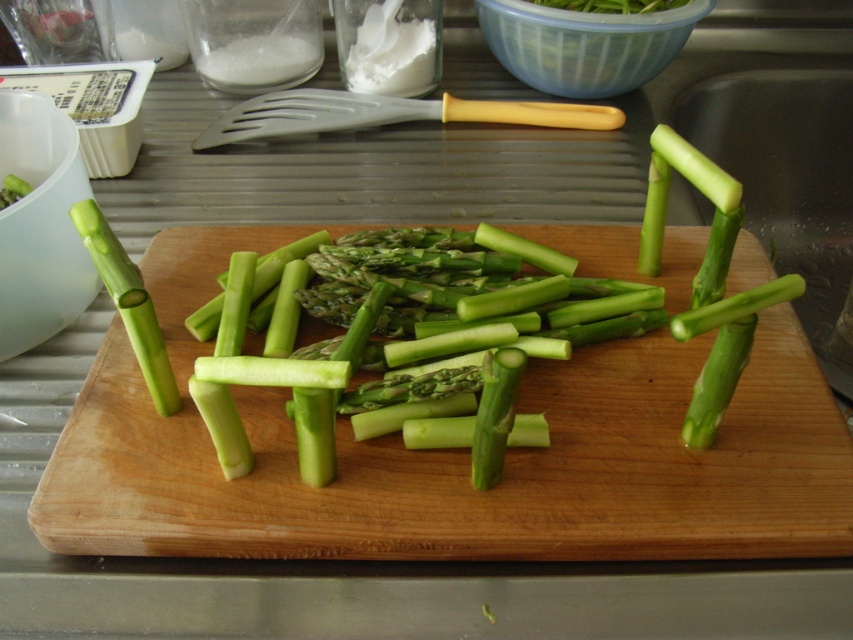
Question: Which object appears farthest from the camera in this image?

Choices:
 (A) green smooth asparagus at center
 (B) green matte asparagus at left
 (C) green wood cutting board at center

Answer: (B)

Question: Can you confirm if green smooth asparagus at center is positioned to the left of green matte asparagus at left?

Choices:
 (A) yes
 (B) no

Answer: (B)

Question: Can you confirm if green wood cutting board at center is thinner than green smooth asparagus at center?

Choices:
 (A) yes
 (B) no

Answer: (B)

Question: Which point is closer to the camera taking this photo?

Choices:
 (A) (234, 333)
 (B) (772, 493)
 (C) (90, 230)

Answer: (C)

Question: Which of the following is the closest to the observer?

Choices:
 (A) green wood cutting board at center
 (B) green smooth asparagus at center
 (C) green matte asparagus at left

Answer: (B)

Question: Does green wood cutting board at center lie in front of green smooth asparagus at center?

Choices:
 (A) yes
 (B) no

Answer: (B)